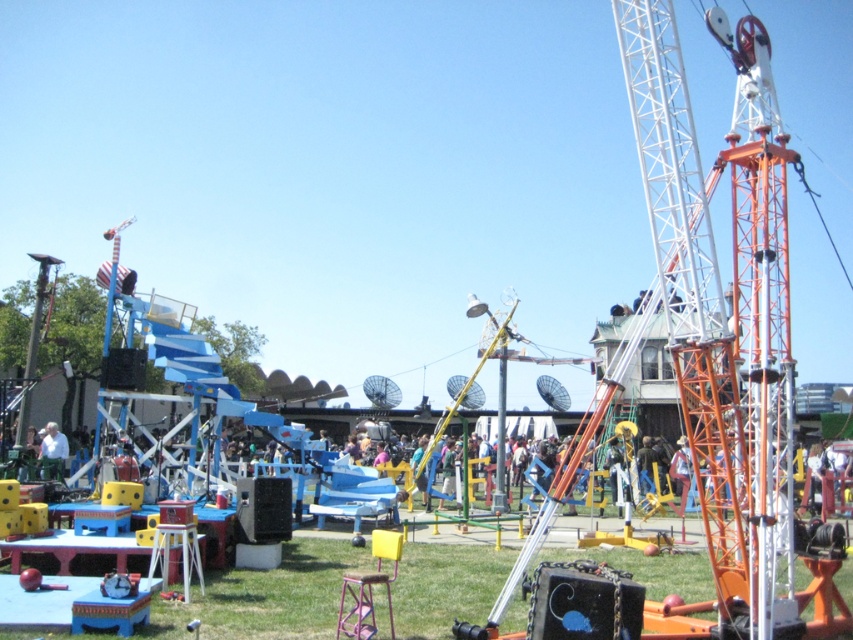
You are a photographer at the fairground. You want to take a photo of the orange metallic crane at right and the light blue shirt at lower left in the same frame. Can you position yourself so that both are visible without one blocking the other?

The orange metallic crane at right is in front of the light blue shirt at lower left, so if you position yourself behind the light blue shirt at lower left, both will be visible without blocking each other.

From the picture: You are standing at the carnival and want to take a photo that includes both the point at coordinates [668,131] and the point at coordinates [51,420]. Given their positions, which point should you position closer to the front of your camera frame to ensure both are visible?

Since point [668,131] is closer to the viewer than point [51,420], you should position the point at coordinates [668,131] closer to the front of your camera frame to ensure both are visible.